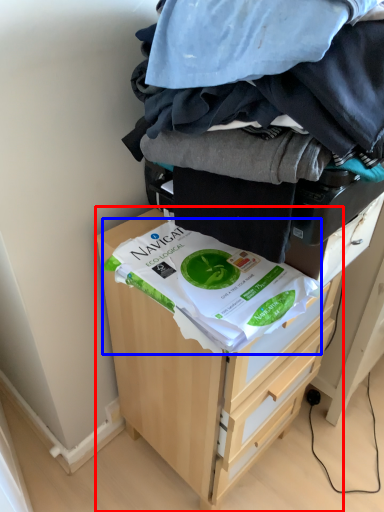
Question: Which object appears closest to the camera in this image, chest of drawers (highlighted by a red box) or food (highlighted by a blue box)?

Choices:
 (A) chest of drawers
 (B) food

Answer: (B)